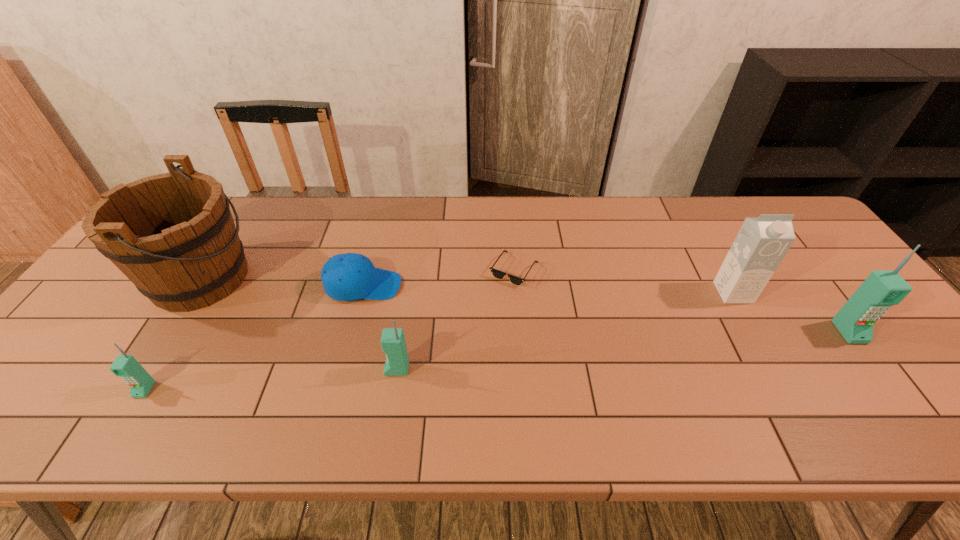
Please point a space for a new cellular_telephone to maintain equal intervals. Please provide its 2D coordinates. Your answer should be formatted as a tuple, i.e. [(x, y)], where the tuple contains the x and y coordinates of a point satisfying the conditions above.

[(632, 350)]